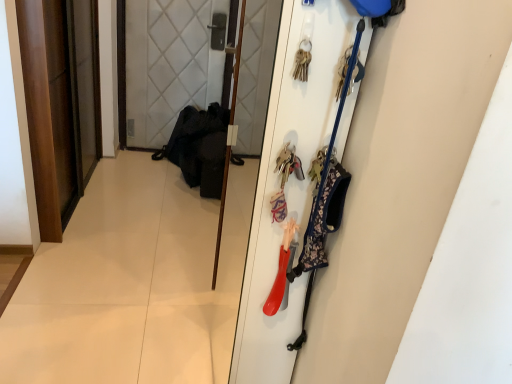
Question: From the image's perspective, is matte plastic door at right, the first door from the right, located above or below wooden door at left, the 1th door in the left-to-right sequence?

Choices:
 (A) above
 (B) below

Answer: (B)

Question: Is matte plastic door at right, which appears as the first door when viewed from the front, taller or shorter than wooden door at left, the 2th door from the right?

Choices:
 (A) short
 (B) tall

Answer: (B)

Question: Which is nearer to the matte plastic door at right, the 2th door viewed from the left?

Choices:
 (A) wooden screen door at center
 (B) wooden door at left, the 2th door from the right

Answer: (A)

Question: Which is farther from the wooden screen door at center?

Choices:
 (A) matte plastic door at right, the second door in the back-to-front sequence
 (B) wooden door at left, the 1th door in the left-to-right sequence

Answer: (A)